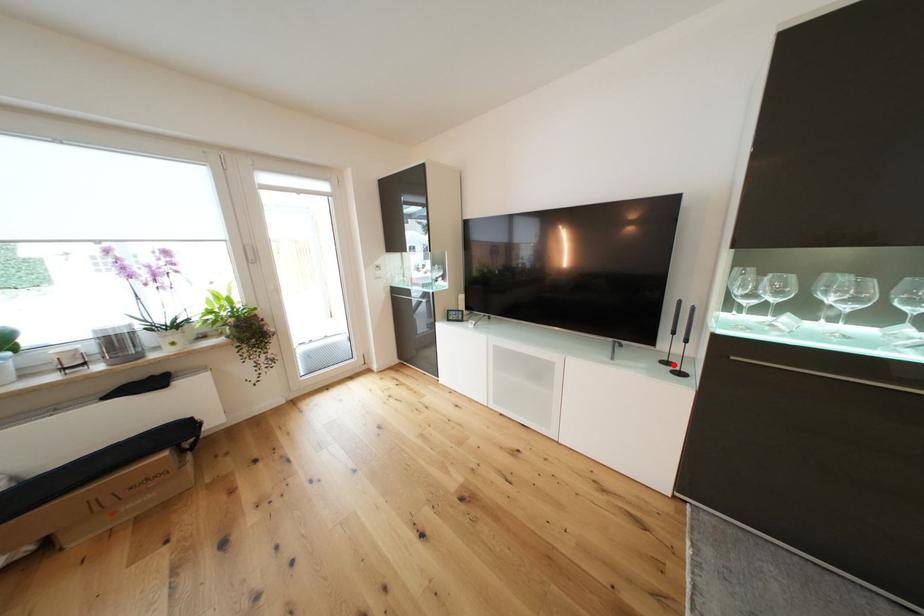
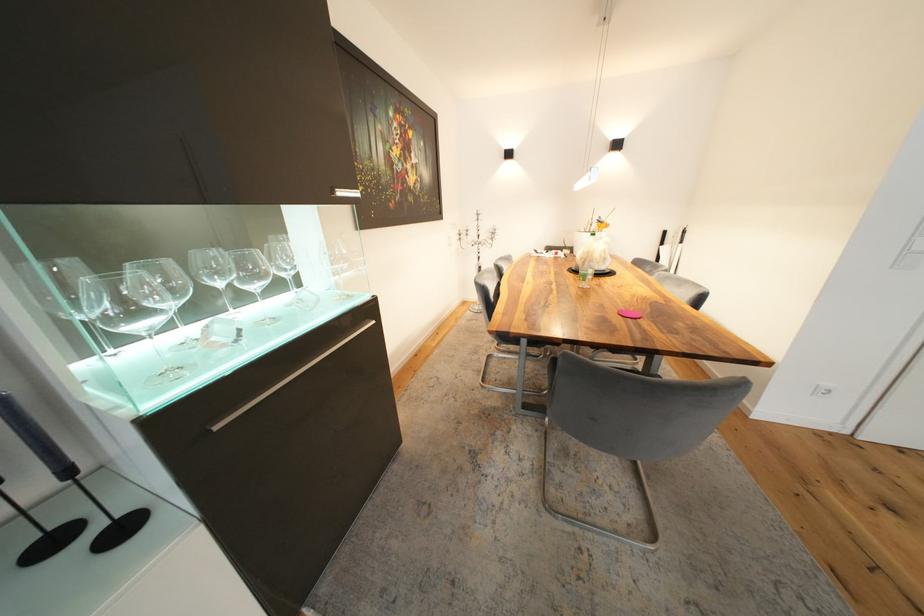
Question: I am providing you with two images of the same scene from different viewpoints. Image1 has a red point marked. In image2, the corresponding 3D location appears at what relative position? Reply with the corresponding letter.

Choices:
 (A) Closer
 (B) Farther

Answer: (B)